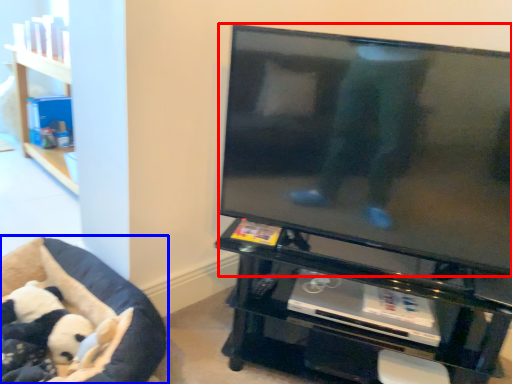
Question: Which point is further to the camera, television (highlighted by a red box) or furniture (highlighted by a blue box)?

Choices:
 (A) television
 (B) furniture

Answer: (B)